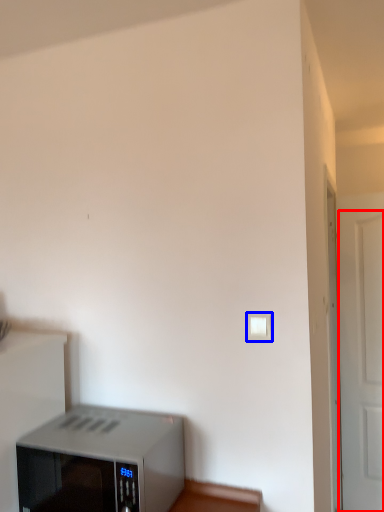
Question: Which point is closer to the camera, door (highlighted by a red box) or light switch (highlighted by a blue box)?

Choices:
 (A) door
 (B) light switch

Answer: (B)